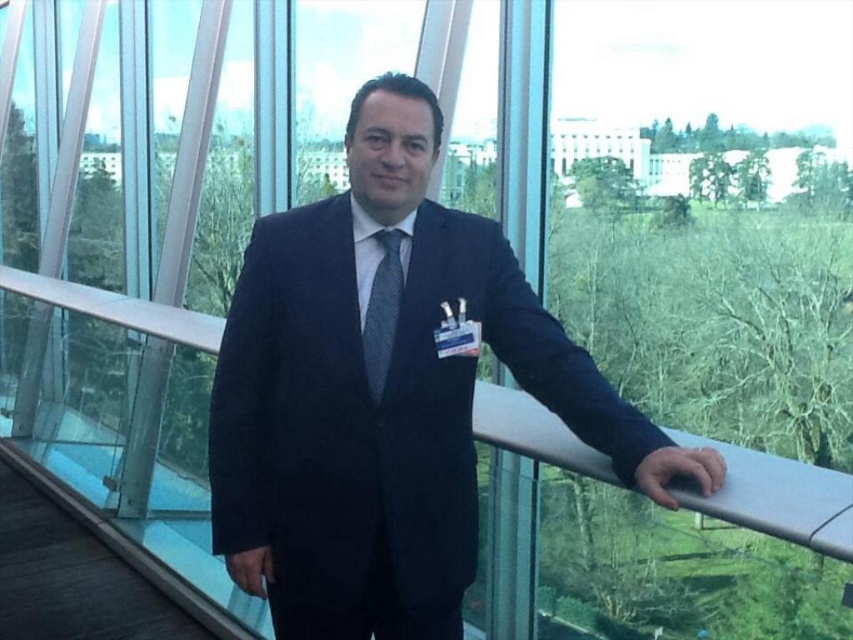
You are a fashion designer observing the man in the navy blue suit at center and the matte gray tie at center. Which clothing item is located more to the right?

The navy blue suit at center is positioned on the right side of matte gray tie at center, so it is more to the right.

You are a fashion designer observing the man in the scene. You need to determine the placement of the navy blue suit at center and the matte gray tie at center. Which object is positioned lower on his body?

The navy blue suit at center is positioned lower on his body than the matte gray tie at center.

You are an event organizer checking attendee attire. You notice the navy blue suit at center and the matte gray tie at center. Which item is taller?

The navy blue suit at center is taller than the matte gray tie at center.